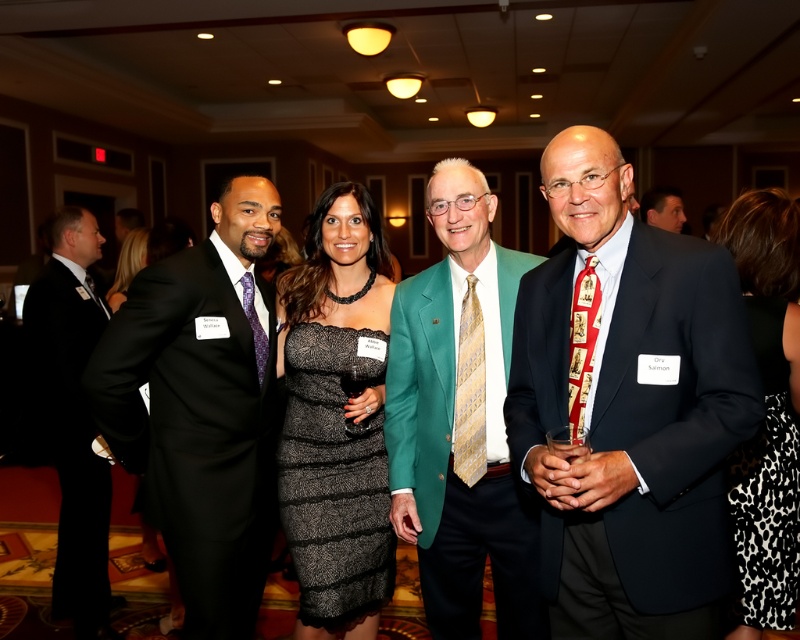
Question: Which object is closer to the camera taking this photo?

Choices:
 (A) black leopard print dress at right
 (B) matte black suit at left
 (C) matte black suit at right

Answer: (C)

Question: Can you confirm if green textured blazer at center is bigger than black suit at left?

Choices:
 (A) yes
 (B) no

Answer: (B)

Question: Which object appears farthest from the camera in this image?

Choices:
 (A) black leopard print dress at right
 (B) matte black suit at center
 (C) black suit at left

Answer: (B)

Question: Considering the real-world distances, which object is closest to the matte black suit at right?

Choices:
 (A) black leopard print dress at right
 (B) matte black suit at center
 (C) black sequined dress at center
 (D) matte black suit at left

Answer: (A)

Question: Can you confirm if green textured blazer at center is positioned below matte black suit at center?

Choices:
 (A) yes
 (B) no

Answer: (A)

Question: Is matte black suit at right further to camera compared to black leopard print dress at right?

Choices:
 (A) no
 (B) yes

Answer: (A)